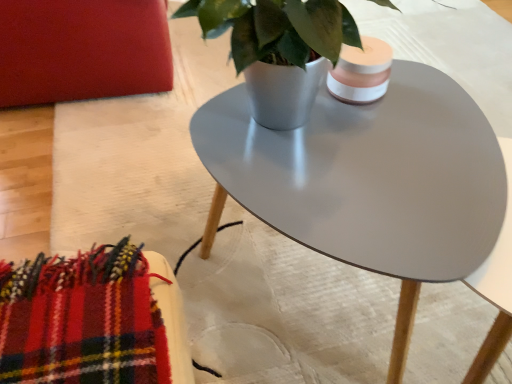
Find the location of a particular element. space that is in front of matte gray pot at center is located at coordinates (351, 213).